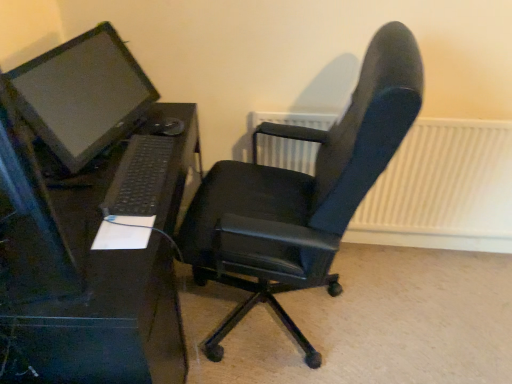
The height and width of the screenshot is (384, 512). I want to click on vacant region above white textured radiator at upper right (from a real-world perspective), so click(440, 110).